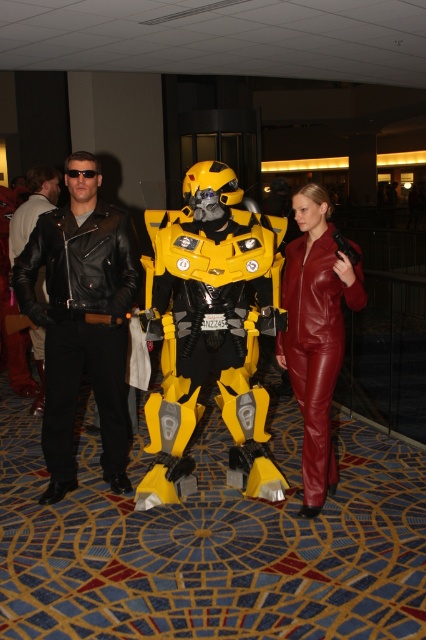
Looking at this image, you are organizing a photo shoot and need to position the yellow matte robot at center and the leather suit at center so that they both fit within a 2.5 meter wide backdrop. Based on their widths, will they fit side by side?

The yellow matte robot at center might be wider than leather suit at center, so their combined width could exceed 2.5 meters. It is uncertain if they will fit without overlapping or adjusting positions.